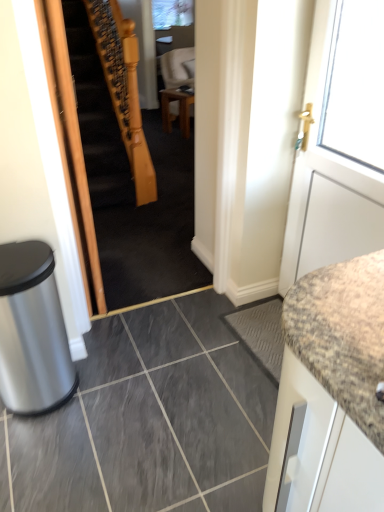
I want to click on wooden staircase at center, so click(132, 187).

Locate an element on the screen. The width and height of the screenshot is (384, 512). wooden table at center is located at coordinates (179, 108).

Looking at the image, does white matte door at right seem bigger or smaller compared to wooden table at center?

white matte door at right is bigger than wooden table at center.

Considering the points (338, 216) and (185, 103), which point is in front, point (338, 216) or point (185, 103)?

The point (338, 216) is more forward.

Can we say white matte door at right lies outside wooden table at center?

Yes, white matte door at right is outside of wooden table at center.

In terms of width, does white matte door at right look wider or thinner when compared to wooden table at center?

Considering their sizes, white matte door at right looks slimmer than wooden table at center.

Is silver metallic trash bin at lower left positioned with its back to white matte door at right?

No, silver metallic trash bin at lower left is not facing the opposite direction of white matte door at right.

From the image's perspective, which one is positioned higher, silver metallic trash bin at lower left or white matte door at right?

From the image's view, white matte door at right is above.

Does silver metallic trash bin at lower left appear on the left side of white matte door at right?

Yes.

In terms of height, does silver metallic trash bin at lower left look taller or shorter compared to white matte door at right?

silver metallic trash bin at lower left is shorter than white matte door at right.

Is gray matte tile at center positioned beyond the bounds of wooden table at center?

gray matte tile at center lies outside wooden table at center's area.

Consider the image. Can you confirm if gray matte tile at center is smaller than wooden table at center?

Actually, gray matte tile at center might be larger than wooden table at center.

Can you tell me how much gray matte tile at center and wooden table at center differ in facing direction?

The angle between the facing direction of gray matte tile at center and the facing direction of wooden table at center is 111 degrees.

From a real-world perspective, is gray matte tile at center located beneath wooden table at center?

Yes, from a real-world perspective, gray matte tile at center is below wooden table at center.

This screenshot has width=384, height=512. In order to click on trash bin/can behind the white matte door at right in this screenshot , I will do `click(32, 331)`.

Does white matte door at right have a greater height compared to silver metallic trash bin at lower left?

Answer: Correct, white matte door at right is much taller as silver metallic trash bin at lower left.

How different are the orientations of white matte door at right and silver metallic trash bin at lower left in degrees?

The facing directions of white matte door at right and silver metallic trash bin at lower left are 86.9 degrees apart.

Is white matte door at right not within silver metallic trash bin at lower left?

Indeed, white matte door at right is completely outside silver metallic trash bin at lower left.

Looking at this image, from the image's perspective, which one is positioned lower, wooden staircase at center or white matte door at right?

white matte door at right.

Find the location of a particular element. The image size is (384, 512). stairwell to the left of white matte door at right is located at coordinates (132, 187).

From a real-world perspective, is wooden staircase at center physically below white matte door at right?

No, from a real-world perspective, wooden staircase at center is not under white matte door at right.

How different are the orientations of wooden staircase at center and white matte door at right in degrees?

wooden staircase at center and white matte door at right are facing 87.3 degrees away from each other.

Considering the sizes of objects wooden staircase at center and silver metallic trash bin at lower left in the image provided, who is shorter, wooden staircase at center or silver metallic trash bin at lower left?

silver metallic trash bin at lower left is shorter.

Locate an element on the screen. Image resolution: width=384 pixels, height=512 pixels. trash bin/can in front of the wooden staircase at center is located at coordinates (32, 331).

Is wooden staircase at center touching silver metallic trash bin at lower left?

No, wooden staircase at center is not with silver metallic trash bin at lower left.

Is wooden staircase at center wider than silver metallic trash bin at lower left?

In fact, wooden staircase at center might be narrower than silver metallic trash bin at lower left.

Which is in front, point (16, 383) or point (126, 158)?

Positioned in front is point (16, 383).

Is silver metallic trash bin at lower left positioned with its back to wooden staircase at center?

No, silver metallic trash bin at lower left's orientation is not away from wooden staircase at center.

From a real-world perspective, is silver metallic trash bin at lower left physically above wooden staircase at center?

Incorrect, from a real-world perspective, silver metallic trash bin at lower left is lower than wooden staircase at center.

What's the angular difference between silver metallic trash bin at lower left and wooden staircase at center's facing directions?

The angular difference between silver metallic trash bin at lower left and wooden staircase at center is 0.367 degrees.

Where is `table that is on the left side of white matte door at right`? table that is on the left side of white matte door at right is located at coordinates (179, 108).

Locate an element on the screen. trash bin/can lying below the white matte door at right (from the image's perspective) is located at coordinates (32, 331).

From the image, which object appears to be farther from wooden table at center, white matte door at right or gray matte tile at center?

gray matte tile at center is further to wooden table at center.

When comparing their distances from wooden table at center, does gray matte tile at center or white matte door at right seem further?

Based on the image, gray matte tile at center appears to be further to wooden table at center.

From the image, which object appears to be farther from gray matte tile at center, wooden staircase at center or wooden table at center?

wooden table at center.

Looking at the image, which one is located closer to wooden staircase at center, white matte door at right or wooden table at center?

The object closer to wooden staircase at center is white matte door at right.

Which object lies nearer to the anchor point white matte door at right, wooden table at center or wooden staircase at center?

The object closer to white matte door at right is wooden staircase at center.

Based on their spatial positions, is wooden table at center or gray matte tile at center further from silver metallic trash bin at lower left?

The object further to silver metallic trash bin at lower left is wooden table at center.

From the image, which object appears to be farther from silver metallic trash bin at lower left, gray matte tile at center or wooden table at center?

wooden table at center is further to silver metallic trash bin at lower left.

When comparing their distances from wooden table at center, does silver metallic trash bin at lower left or white matte door at right seem closer?

white matte door at right.

This screenshot has width=384, height=512. Identify the location of stairwell located between gray matte tile at center and wooden table at center in the depth direction. (132, 187).

Find the location of `stairwell between silver metallic trash bin at lower left and white matte door at right`. stairwell between silver metallic trash bin at lower left and white matte door at right is located at coordinates tap(132, 187).

Locate an element on the screen. stairwell between silver metallic trash bin at lower left and wooden table at center along the z-axis is located at coordinates (132, 187).

The width and height of the screenshot is (384, 512). In order to click on trash bin/can between white matte door at right and wooden table at center in the front-back direction in this screenshot , I will do `click(32, 331)`.